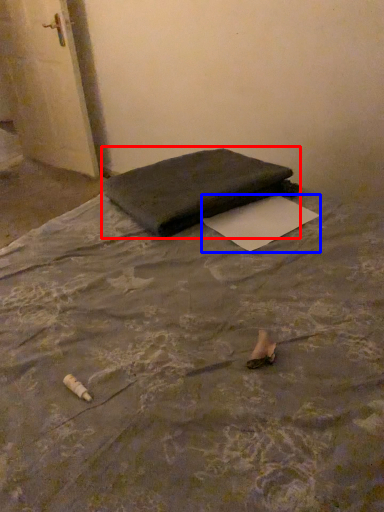
Question: Which object is closer to the camera taking this photo, furniture (highlighted by a red box) or paper (highlighted by a blue box)?

Choices:
 (A) furniture
 (B) paper

Answer: (B)